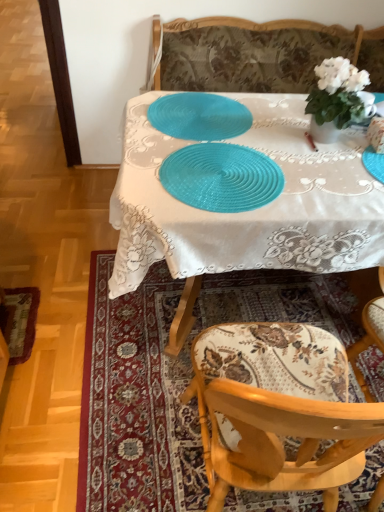
Locate an element on the screen. free point below teal woven placemat at center, marked as the 2th tableware in a top-to-bottom arrangement (from a real-world perspective) is located at coordinates (227, 175).